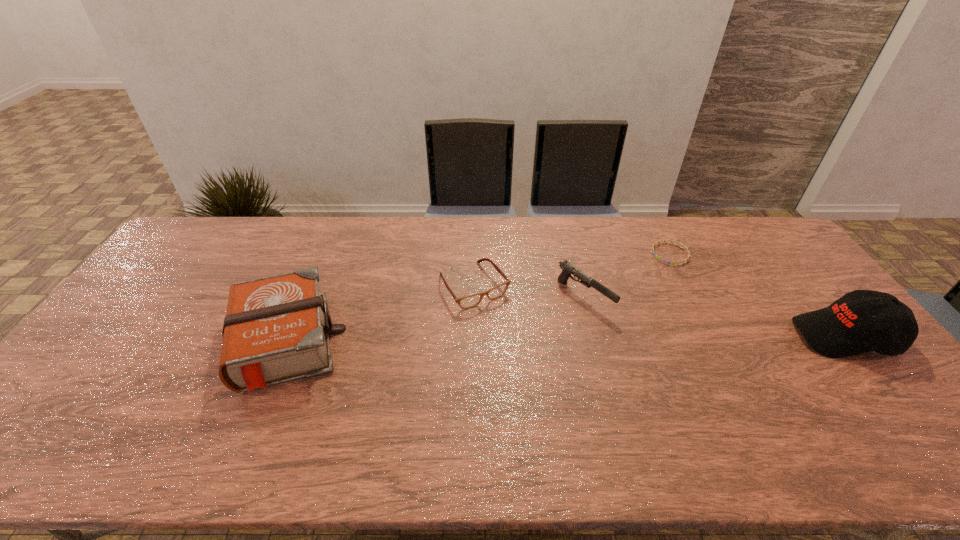
Find the location of a particular element. free spot located on the surface of the bracelet showing star-shaped elements is located at coordinates (585, 319).

The width and height of the screenshot is (960, 540). In order to click on object that is at the far edge in this screenshot , I will do `click(652, 248)`.

This screenshot has width=960, height=540. Find the location of `object present at the near edge`. object present at the near edge is located at coordinates (276, 329).

Find the location of `object that is at the right edge`. object that is at the right edge is located at coordinates [x=861, y=321].

You are a GUI agent. You are given a task and a screenshot of the screen. Output one action in this format:
    pyautogui.click(x=<x>, y=<y>)
    Task: Click on the vacant area at the far edge
    
    Given the screenshot: What is the action you would take?
    pyautogui.click(x=261, y=229)

Locate an element on the screen. vacant region at the near edge of the desktop is located at coordinates [x=831, y=394].

Locate an element on the screen. The width and height of the screenshot is (960, 540). free region at the right edge is located at coordinates (827, 298).

What are the coordinates of `vacant space at the far left corner of the desktop` in the screenshot? It's located at (178, 258).

Identify the location of free space at the far right corner of the desktop. The image size is (960, 540). (736, 225).

Where is `vacant point located between the baseball cap and the leftmost object`? vacant point located between the baseball cap and the leftmost object is located at coordinates 564,339.